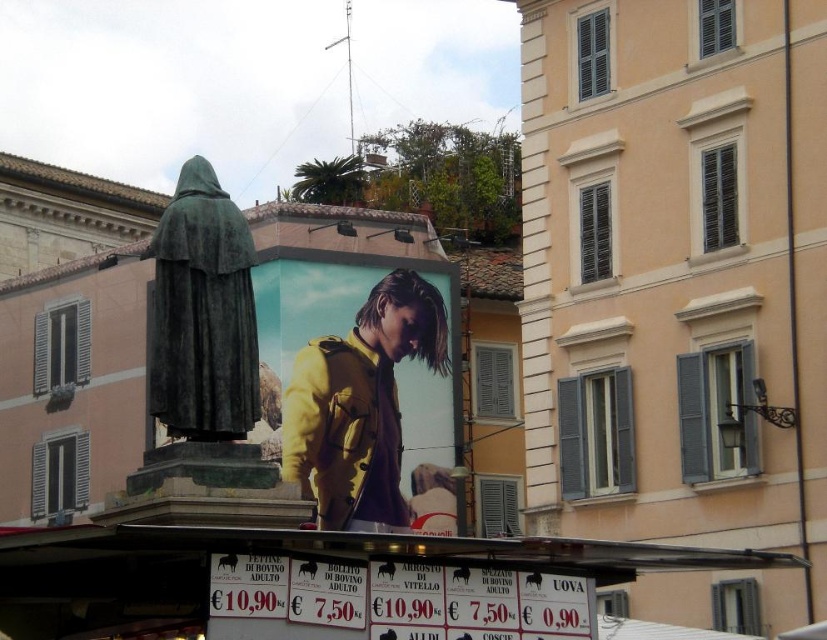
Question: Considering the real-world distances, which object is farthest from the white paper signboard at lower center?

Choices:
 (A) green bronze statue at center
 (B) yellow matte jacket at center

Answer: (B)

Question: Is white paper signboard at lower center to the right of green bronze statue at center from the viewer's perspective?

Choices:
 (A) yes
 (B) no

Answer: (A)

Question: Does white paper signboard at lower center appear under green bronze statue at center?

Choices:
 (A) no
 (B) yes

Answer: (B)

Question: Which of these objects is positioned farthest from the yellow matte jacket at center?

Choices:
 (A) white paper signboard at lower center
 (B) green bronze statue at center

Answer: (A)

Question: Can you confirm if yellow matte jacket at center is smaller than green bronze statue at center?

Choices:
 (A) no
 (B) yes

Answer: (B)

Question: Estimate the real-world distances between objects in this image. Which object is farther from the green bronze statue at center?

Choices:
 (A) white paper signboard at lower center
 (B) yellow matte jacket at center

Answer: (A)